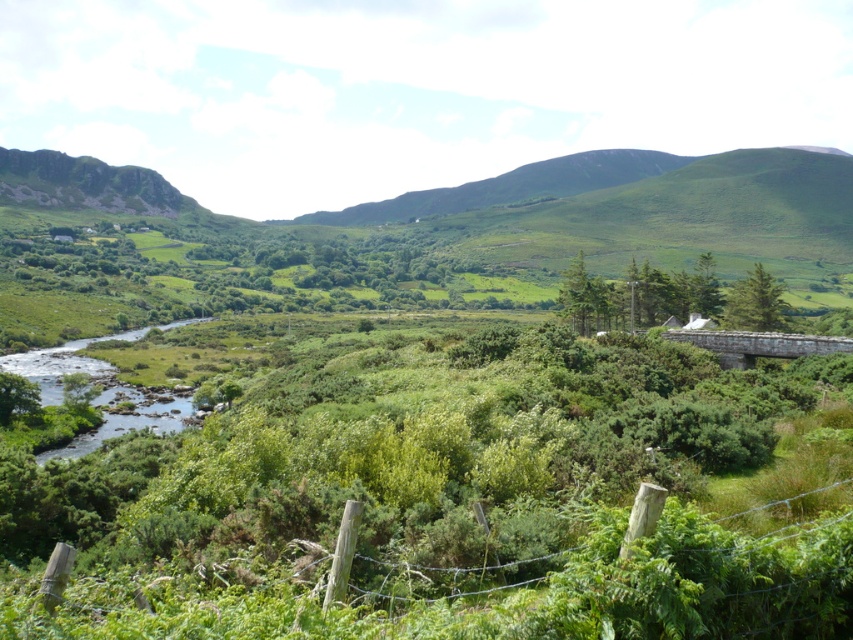
Is point (558, 296) farther from camera compared to point (779, 284)?

That is False.

Does point (606, 316) come in front of point (746, 285)?

Yes, it is in front of point (746, 285).

Between point (627, 278) and point (759, 269), which one is positioned in front?

Point (759, 269)

Locate an element on the screen. Image resolution: width=853 pixels, height=640 pixels. green leafy tree at center is located at coordinates (637, 296).

Does green leafy tree at right have a lesser height compared to green matte tree at center?

Indeed, green leafy tree at right has a lesser height compared to green matte tree at center.

Does point (747, 298) come in front of point (573, 321)?

Yes, it is in front of point (573, 321).

Image resolution: width=853 pixels, height=640 pixels. In order to click on green leafy tree at right in this screenshot , I will do `click(755, 301)`.

Between point (637, 308) and point (569, 288), which one is positioned behind?

The point (637, 308) is behind.

Where is `green leafy tree at center`? green leafy tree at center is located at coordinates (637, 296).

This screenshot has width=853, height=640. I want to click on green leafy tree at center, so click(x=637, y=296).

Locate an element on the screen. The width and height of the screenshot is (853, 640). green leafy tree at center is located at coordinates (637, 296).